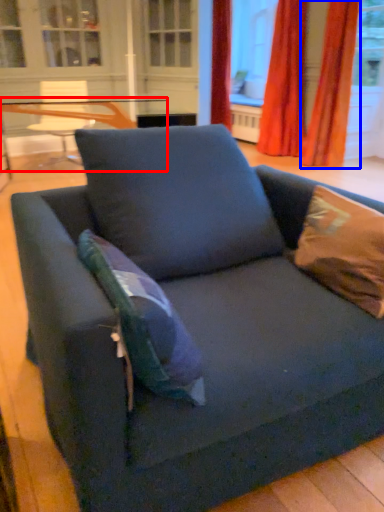
Question: Which object is further to the camera taking this photo, table (highlighted by a red box) or curtain (highlighted by a blue box)?

Choices:
 (A) table
 (B) curtain

Answer: (B)